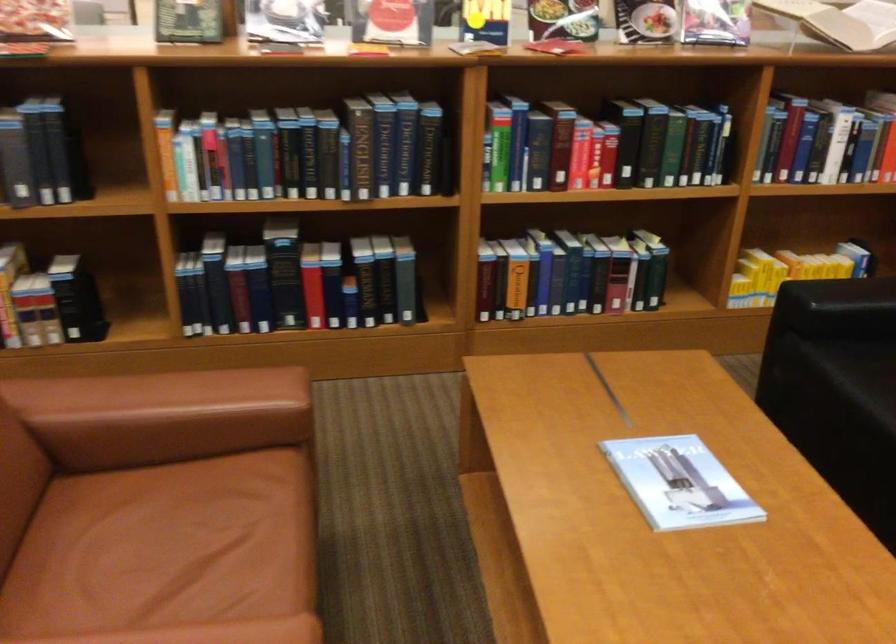
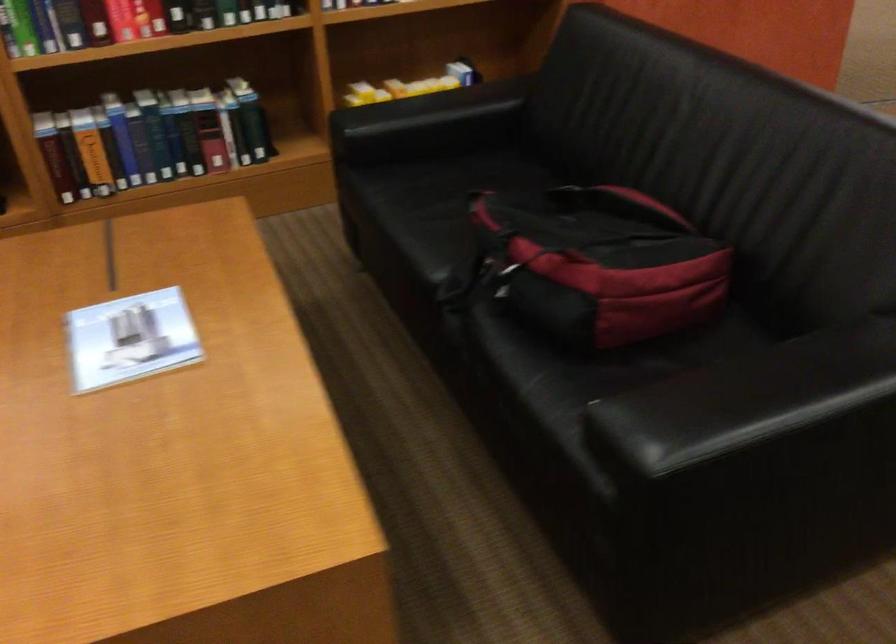
In the second image, find the point that corresponds to point (580, 173) in the first image.

(123, 21)